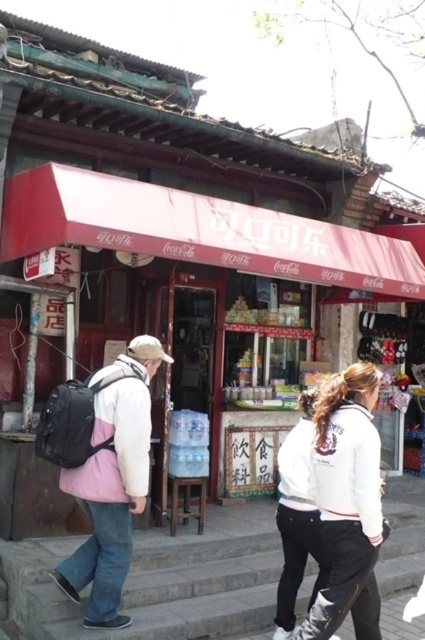
Is white fleece jacket at center wider than pink fleece sweatshirt at left?

Indeed, white fleece jacket at center has a greater width compared to pink fleece sweatshirt at left.

Who is shorter, white fleece jacket at center or pink fleece sweatshirt at left?

Standing shorter between the two is pink fleece sweatshirt at left.

The image size is (425, 640). Find the location of `white fleece jacket at center`. white fleece jacket at center is located at coordinates (345, 502).

You are a GUI agent. You are given a task and a screenshot of the screen. Output one action in this format:
    pyautogui.click(x=<x>, y=<y>)
    Task: Click on the white fleece jacket at center
    
    Given the screenshot: What is the action you would take?
    pyautogui.click(x=345, y=502)

Does gray concrete steps at lower center lie behind white fleece jacket at center?

Yes, it is.

Between gray concrete steps at lower center and white fleece jacket at center, which one has more height?

With more height is white fleece jacket at center.

Image resolution: width=425 pixels, height=640 pixels. What do you see at coordinates (161, 580) in the screenshot?
I see `gray concrete steps at lower center` at bounding box center [161, 580].

At what (x,y) coordinates should I click in order to perform the action: click on gray concrete steps at lower center. Please return your answer as a coordinate pair (x, y). Looking at the image, I should click on (161, 580).

Is light pink fabric jacket at left wider than pink fleece sweatshirt at left?

Yes, light pink fabric jacket at left is wider than pink fleece sweatshirt at left.

Between point (113, 365) and point (99, 410), which one is positioned in front?

Point (99, 410) is in front.

I want to click on light pink fabric jacket at left, so click(113, 481).